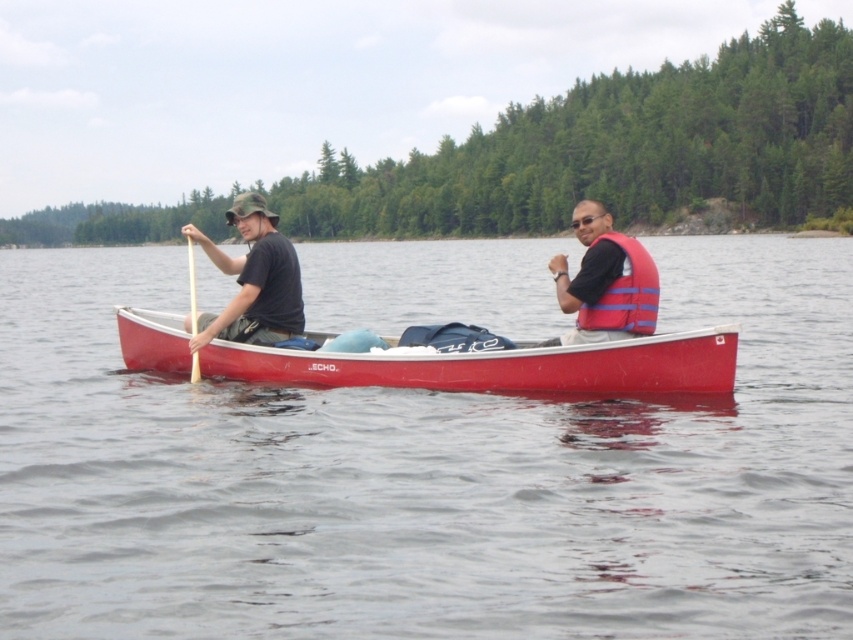
You are a photographer trying to capture the scene of two people in the canoe. You want to ensure both the matte black shirt at left and the blue fabric life jacket at center are clearly visible in your shot. Based on their positions, which object should you focus on first to ensure both are in frame?

The matte black shirt at left is to the left of the blue fabric life jacket at center. To ensure both are in frame, focus on the matte black shirt at left first since it is positioned further left, allowing the life jacket to be included in the shot when framing from left to right.